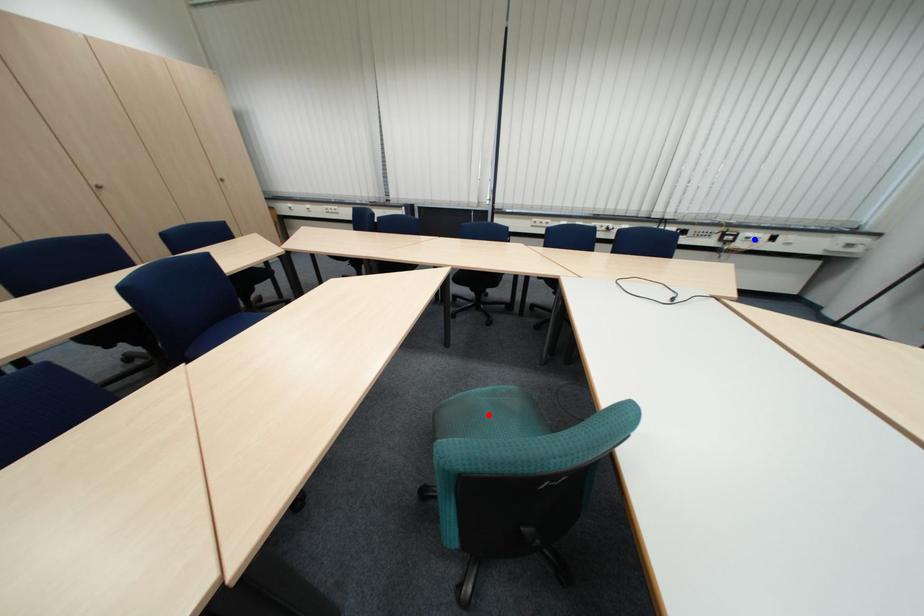
Question: In the image, two points are highlighted. Which point is nearer to the camera? Reply with the corresponding letter.

Choices:
 (A) blue point
 (B) red point

Answer: (B)